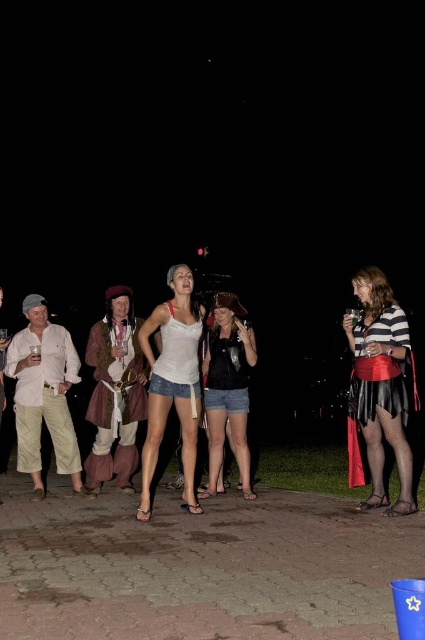
You are at a costume party and see two people wearing a striped jersey skirt at center and a matte black shirt at center. Which one is positioned more to the right side?

The striped jersey skirt at center is positioned more to the right side than the matte black shirt at center.

You are organizing a costume party and need to place the light beige cotton pants at left and the matte brown leather jacket at center into storage. The storage bin you have can only hold items that are 20 inches apart. Will both items fit in the bin without overlapping?

The light beige cotton pants at left and matte brown leather jacket at center are 20.59 inches apart from each other. Since the storage bin can only hold items 20 inches apart, they will not fit without overlapping.

You are standing at the center of the gathering and want to move towards the two points marked in the image. Which point, point [135,372] or point [218,413], is closer to you?

Point [135,372] is closer to you because it is further to the viewer than point [218,413].